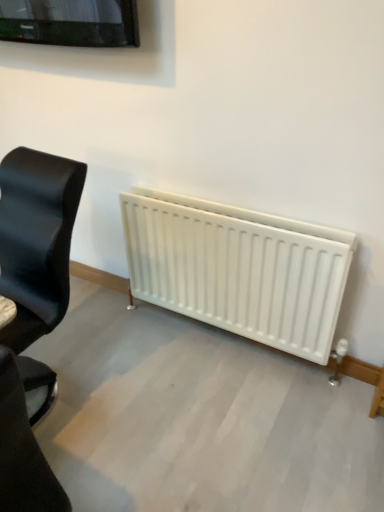
Question: Does black leather chair at lower left, arranged as the second chair when viewed from the back, have a greater height compared to black leather chair at left, which is counted as the first chair, starting from the back?

Choices:
 (A) yes
 (B) no

Answer: (A)

Question: From a real-world perspective, does black leather chair at lower left, positioned as the first chair in front-to-back order, stand above black leather chair at left, the 2th chair when ordered from front to back?

Choices:
 (A) yes
 (B) no

Answer: (B)

Question: Can you confirm if black leather chair at lower left, positioned as the first chair in front-to-back order, is wider than black leather chair at left, which is counted as the first chair, starting from the back?

Choices:
 (A) no
 (B) yes

Answer: (B)

Question: Can you confirm if black leather chair at lower left, arranged as the second chair when viewed from the back, is bigger than black leather chair at left, the 2th chair when ordered from front to back?

Choices:
 (A) yes
 (B) no

Answer: (B)

Question: Is black leather chair at lower left, positioned as the first chair in front-to-back order, oriented towards black leather chair at left, which is counted as the first chair, starting from the back?

Choices:
 (A) yes
 (B) no

Answer: (B)

Question: Is black leather chair at lower left, positioned as the first chair in front-to-back order, with black leather chair at left, the 2th chair when ordered from front to back?

Choices:
 (A) no
 (B) yes

Answer: (A)

Question: Considering the relative sizes of black leather chair at left, which is counted as the first chair, starting from the back, and black leather chair at lower left, arranged as the second chair when viewed from the back, in the image provided, is black leather chair at left, which is counted as the first chair, starting from the back, wider than black leather chair at lower left, arranged as the second chair when viewed from the back,?

Choices:
 (A) no
 (B) yes

Answer: (A)

Question: From the image's perspective, is black leather chair at left, which is counted as the first chair, starting from the back, located beneath black leather chair at lower left, positioned as the first chair in front-to-back order?

Choices:
 (A) no
 (B) yes

Answer: (A)

Question: Does black leather chair at left, which is counted as the first chair, starting from the back, have a smaller size compared to black leather chair at lower left, positioned as the first chair in front-to-back order?

Choices:
 (A) yes
 (B) no

Answer: (B)

Question: Does black leather chair at left, the 2th chair when ordered from front to back, lie behind black leather chair at lower left, arranged as the second chair when viewed from the back?

Choices:
 (A) no
 (B) yes

Answer: (B)

Question: Are black leather chair at left, the 2th chair when ordered from front to back, and black leather chair at lower left, positioned as the first chair in front-to-back order, far apart?

Choices:
 (A) yes
 (B) no

Answer: (B)

Question: Considering the relative positions of black leather chair at left, which is counted as the first chair, starting from the back, and black leather chair at lower left, arranged as the second chair when viewed from the back, in the image provided, is black leather chair at left, which is counted as the first chair, starting from the back, to the left of black leather chair at lower left, arranged as the second chair when viewed from the back, from the viewer's perspective?

Choices:
 (A) no
 (B) yes

Answer: (B)

Question: Which is correct: black leather chair at left, the 2th chair when ordered from front to back, is inside black leather chair at lower left, arranged as the second chair when viewed from the back, or outside of it?

Choices:
 (A) outside
 (B) inside

Answer: (A)